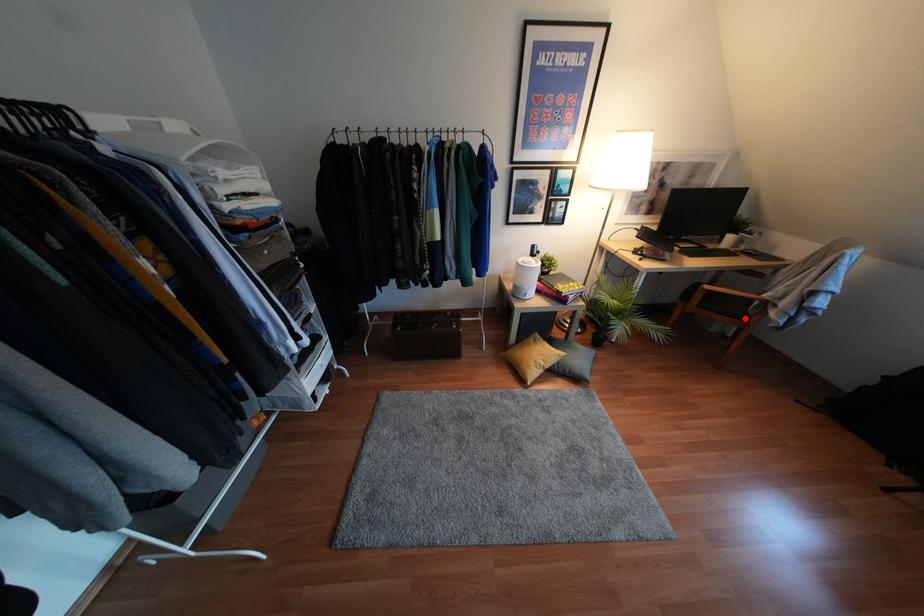
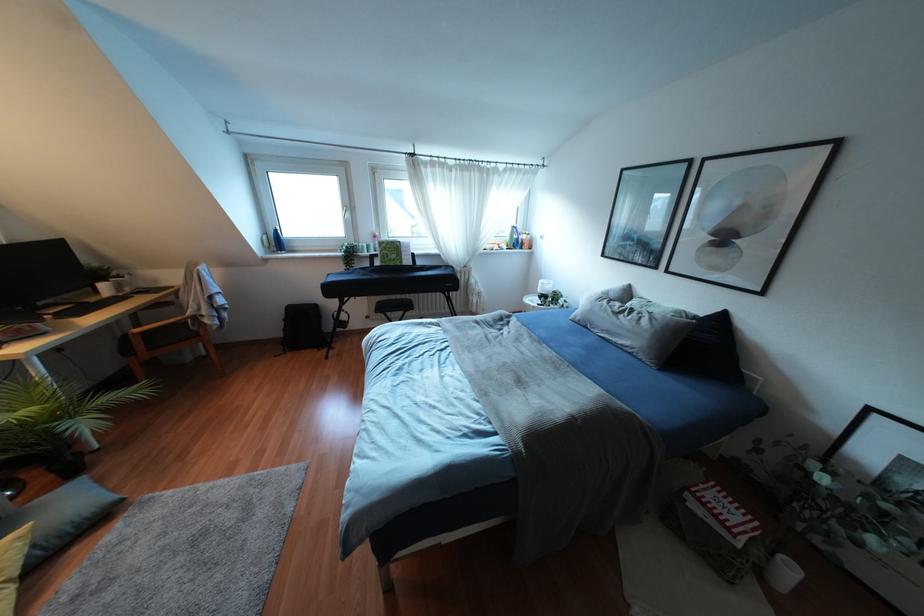
Question: A red point is marked in image1. In image2, is the corresponding 3D point closer to the camera or farther? Reply with the corresponding letter.

Choices:
 (A) The corresponding 3D point is closer.
 (B) The corresponding 3D point is farther.

Answer: (B)